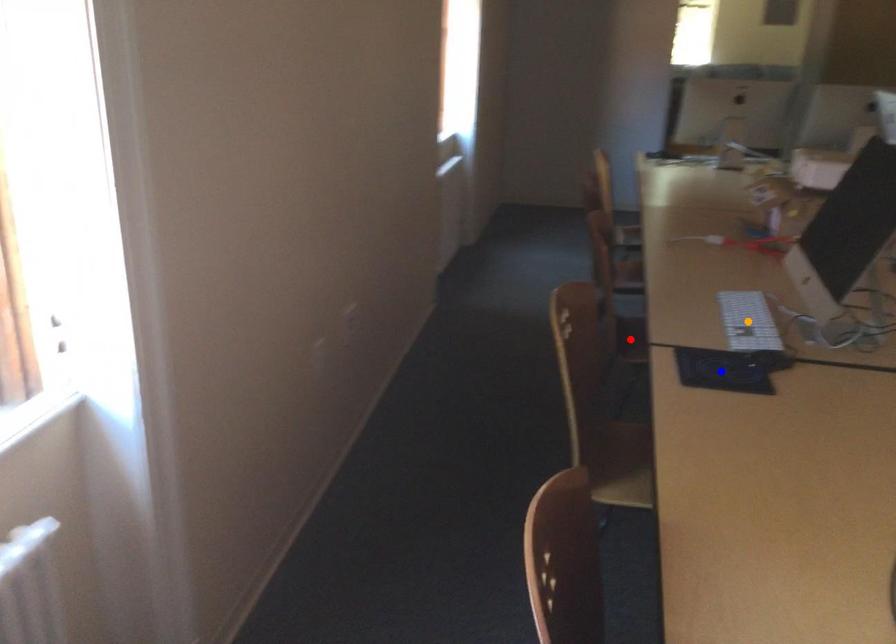
Order these from nearest to farthest:
1. blue point
2. orange point
3. red point

red point, orange point, blue point